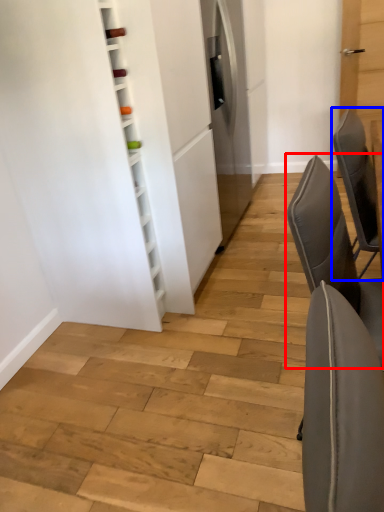
Question: Which object appears farthest to the camera in this image, chair (highlighted by a red box) or chair (highlighted by a blue box)?

Choices:
 (A) chair
 (B) chair

Answer: (B)